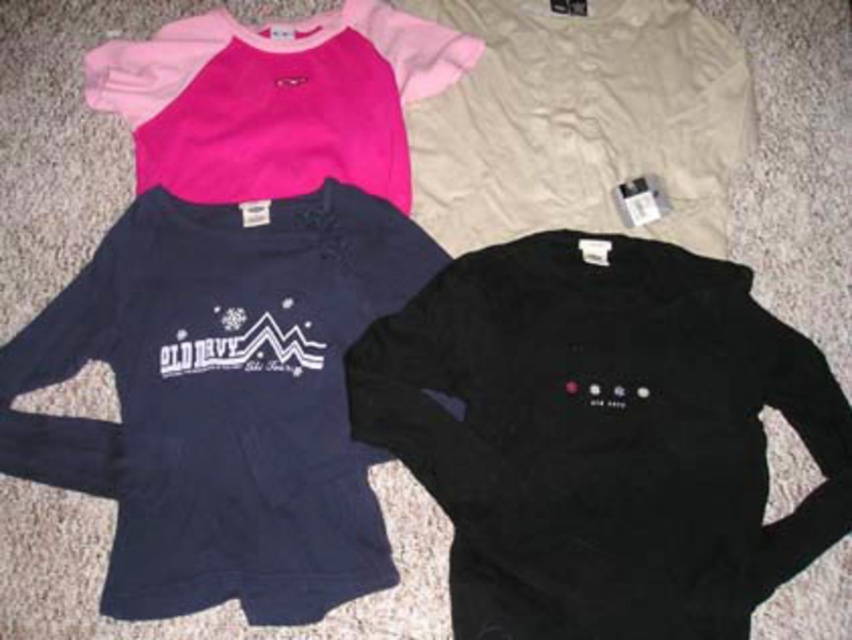
Question: Estimate the real-world distances between objects in this image. Which object is farther from the pink fleece sweatshirt at upper left?

Choices:
 (A) navy fleece sweatshirt at upper left
 (B) black fleece sweatshirt at lower right
 (C) beige cotton sweatshirt at upper center

Answer: (B)

Question: Which is nearer to the navy fleece sweatshirt at upper left?

Choices:
 (A) pink fleece sweatshirt at upper left
 (B) beige cotton sweatshirt at upper center
 (C) black fleece sweatshirt at lower right

Answer: (A)

Question: Observing the image, what is the correct spatial positioning of black fleece sweatshirt at lower right in reference to pink fleece sweatshirt at upper left?

Choices:
 (A) left
 (B) right

Answer: (B)

Question: Is black fleece sweatshirt at lower right bigger than pink fleece sweatshirt at upper left?

Choices:
 (A) no
 (B) yes

Answer: (B)

Question: Can you confirm if black fleece sweatshirt at lower right is positioned to the right of pink fleece sweatshirt at upper left?

Choices:
 (A) yes
 (B) no

Answer: (A)

Question: Which object is the farthest from the black fleece sweatshirt at lower right?

Choices:
 (A) navy fleece sweatshirt at upper left
 (B) pink fleece sweatshirt at upper left
 (C) beige cotton sweatshirt at upper center

Answer: (B)